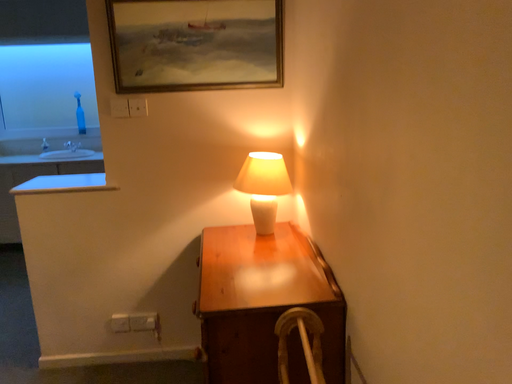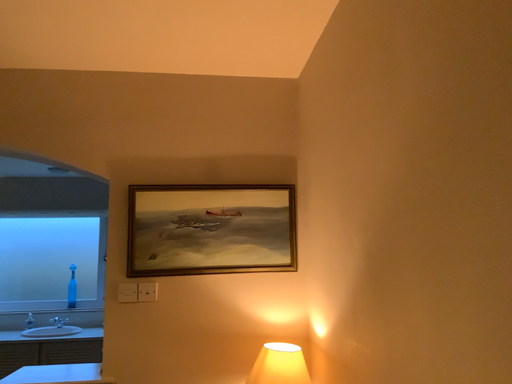
Question: How did the camera likely rotate when shooting the video?

Choices:
 (A) rotated downward
 (B) rotated upward

Answer: (B)